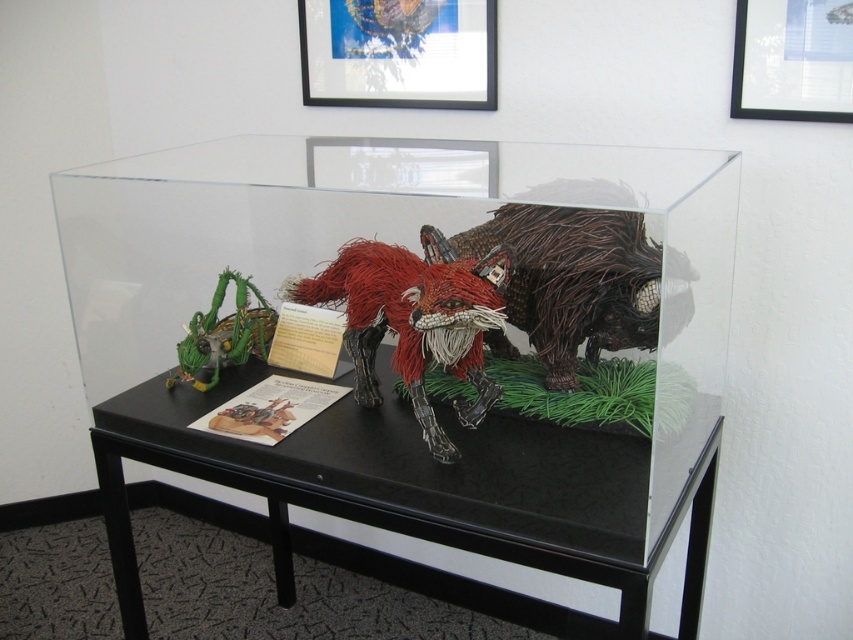
Looking at this image, is clear acrylic box at center shorter than matte black picture frame at upper right?

No, clear acrylic box at center is not shorter than matte black picture frame at upper right.

Between clear acrylic box at center and matte black picture frame at upper right, which one appears on the left side from the viewer's perspective?

Positioned to the left is clear acrylic box at center.

The image size is (853, 640). What do you see at coordinates (412, 340) in the screenshot? I see `clear acrylic box at center` at bounding box center [412, 340].

The width and height of the screenshot is (853, 640). Find the location of `clear acrylic box at center`. clear acrylic box at center is located at coordinates (412, 340).

Between clear acrylic box at center and wire sculpture at center, which one appears on the right side from the viewer's perspective?

Positioned to the right is wire sculpture at center.

Is the position of clear acrylic box at center less distant than that of wire sculpture at center?

Yes.

Is point (457, 426) closer to camera compared to point (476, 243)?

Yes.

You are a GUI agent. You are given a task and a screenshot of the screen. Output one action in this format:
    pyautogui.click(x=<x>, y=<y>)
    Task: Click on the clear acrylic box at center
    Image resolution: width=853 pixels, height=640 pixels.
    Given the screenshot: What is the action you would take?
    pyautogui.click(x=412, y=340)

Does red wire fox at center have a greater height compared to matte black picture frame at upper center?

Indeed, red wire fox at center has a greater height compared to matte black picture frame at upper center.

Does point (488, 275) come farther from viewer compared to point (451, 56)?

No, it is in front of (451, 56).

This screenshot has height=640, width=853. I want to click on red wire fox at center, so click(415, 320).